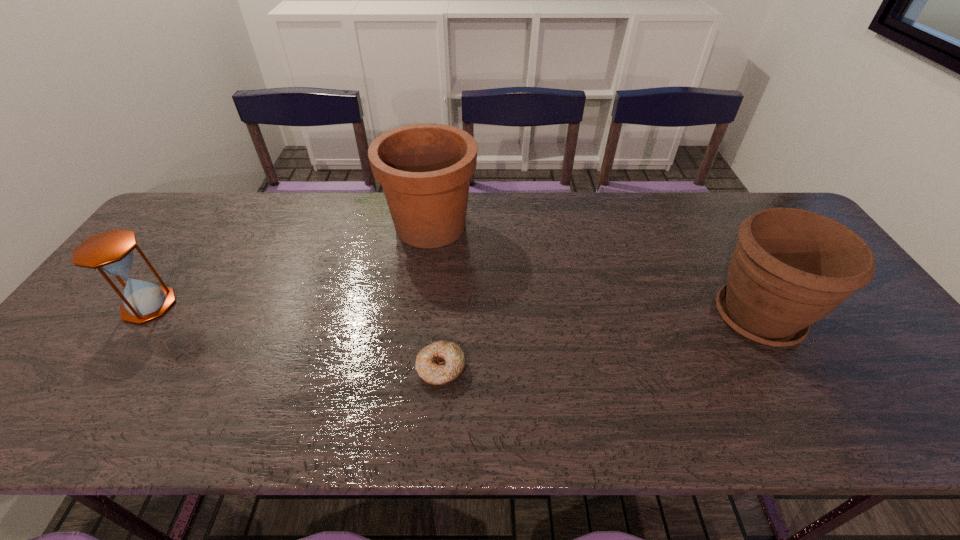
I want to click on vacant point that satisfies the following two spatial constraints: 1. on the front side of the leftmost object; 2. on the right side of the doughnut, so click(105, 368).

The height and width of the screenshot is (540, 960). Find the location of `free spot that satisfies the following two spatial constraints: 1. on the front side of the left flowerpot; 2. on the left side of the shortest object`. free spot that satisfies the following two spatial constraints: 1. on the front side of the left flowerpot; 2. on the left side of the shortest object is located at coordinates (413, 368).

The height and width of the screenshot is (540, 960). Identify the location of vacant area that satisfies the following two spatial constraints: 1. on the front side of the right flowerpot; 2. on the left side of the left flowerpot. (420, 317).

At what (x,y) coordinates should I click in order to perform the action: click on free space that satisfies the following two spatial constraints: 1. on the front side of the leftmost object; 2. on the left side of the shortest object. Please return your answer as a coordinate pair (x, y). The width and height of the screenshot is (960, 540). Looking at the image, I should click on (105, 368).

This screenshot has height=540, width=960. I want to click on vacant space that satisfies the following two spatial constraints: 1. on the front side of the shortest object; 2. on the left side of the leftmost object, so click(105, 368).

Image resolution: width=960 pixels, height=540 pixels. In order to click on free location that satisfies the following two spatial constraints: 1. on the front side of the third tallest object; 2. on the right side of the doughnut in this screenshot , I will do `click(105, 368)`.